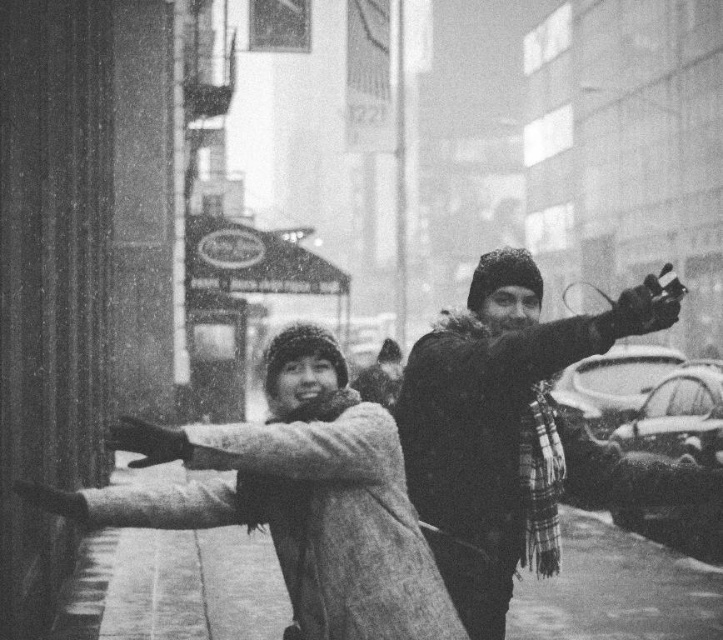
You are standing in the snowy alleyway and see the fuzzy black coat at right. If you want to reach it within 3 seconds, what is the minimum speed you need to move towards it?

The fuzzy black coat at right is 5.47 meters away from viewer. To reach it within 3 seconds, you need to move at a minimum speed of approximately 1.82 meters per second.

In the scene shown: You are standing in the snowy alleyway and want to find the fuzzy wool coat at center. According to the coordinates provided, where should you look to locate it?

The fuzzy wool coat at center is located at point 0.778 on the x axis and 0.409 on the y axis.

You are a photographer trying to capture a group photo of the fuzzy wool coat at center and the fuzzy black coat at right. The minimum distance required between the subjects for your camera to focus properly is 5 feet. Based on the scene, will the camera focus successfully?

The distance between the fuzzy wool coat at center and fuzzy black coat at right is 4.31 feet, which is less than the required 5 feet. Therefore, the camera may not focus properly.